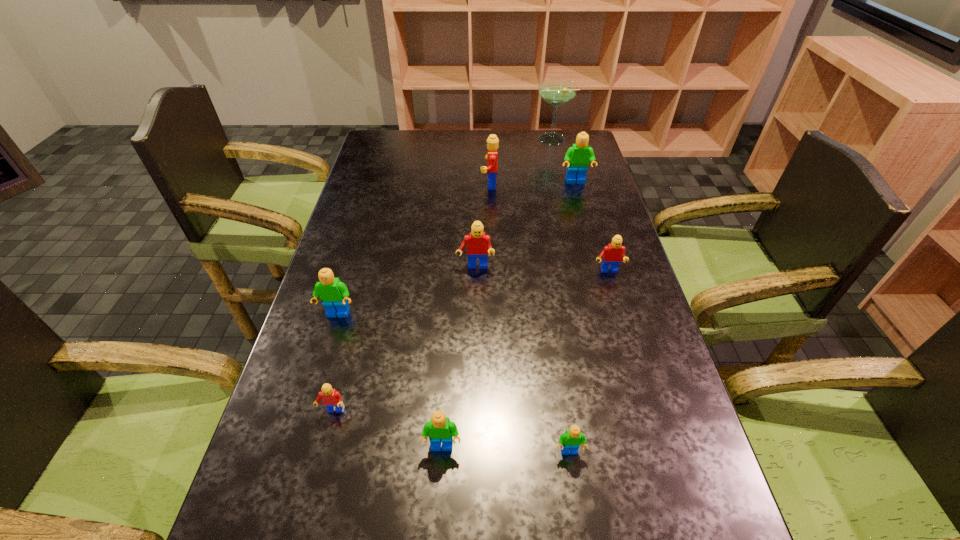
The width and height of the screenshot is (960, 540). In order to click on free point that satisfies the following two spatial constraints: 1. on the front-facing side of the farthest red Lego; 2. on the front-facing side of the third smallest red Lego in this screenshot , I will do `click(492, 267)`.

This screenshot has width=960, height=540. In order to click on free location that satisfies the following two spatial constraints: 1. on the front-facing side of the biggest red Lego; 2. on the front-facing side of the second biggest red Lego in this screenshot , I will do tap(492, 267).

Identify the location of blank area in the image that satisfies the following two spatial constraints: 1. on the front-facing side of the biggest red Lego; 2. on the front-facing side of the third smallest red Lego. This screenshot has height=540, width=960. (492, 267).